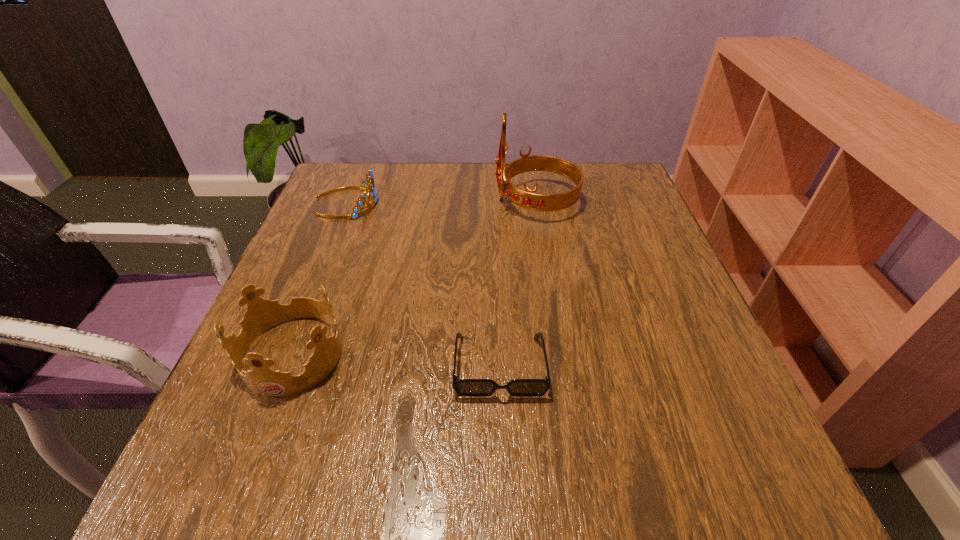
At what (x,y) coordinates should I click in order to perform the action: click on vacant space that is in between the shortest object and the third tallest object. Please return your answer as a coordinate pair (x, y). This screenshot has width=960, height=540. Looking at the image, I should click on (423, 284).

Where is `vacant space in between the nearest tiara and the shortest object`? Image resolution: width=960 pixels, height=540 pixels. vacant space in between the nearest tiara and the shortest object is located at coordinates (396, 360).

The image size is (960, 540). I want to click on vacant area between the nearest tiara and the sunglasses, so [x=396, y=360].

The image size is (960, 540). Find the location of `empty space between the nearest tiara and the tallest tiara`. empty space between the nearest tiara and the tallest tiara is located at coordinates (415, 278).

Where is `free space between the nearest tiara and the sunglasses`? Image resolution: width=960 pixels, height=540 pixels. free space between the nearest tiara and the sunglasses is located at coordinates (396, 360).

You are a GUI agent. You are given a task and a screenshot of the screen. Output one action in this format:
    pyautogui.click(x=<x>, y=<y>)
    Task: Click on the free space between the nearest tiara and the second shortest object
    Image resolution: width=960 pixels, height=540 pixels.
    Given the screenshot: What is the action you would take?
    pyautogui.click(x=320, y=278)

Find the location of `vacant area between the tallest tiara and the shortest object`. vacant area between the tallest tiara and the shortest object is located at coordinates (517, 284).

Where is `free space between the shortest object and the rightmost tiara`? The image size is (960, 540). free space between the shortest object and the rightmost tiara is located at coordinates (517, 284).

I want to click on free spot between the nearest tiara and the sunglasses, so click(x=396, y=360).

Identify which object is located as the second nearest to the shortest object. Please provide its 2D coordinates. Your answer should be formatted as a tuple, i.e. [(x, y)], where the tuple contains the x and y coordinates of a point satisfying the conditions above.

[(528, 199)]